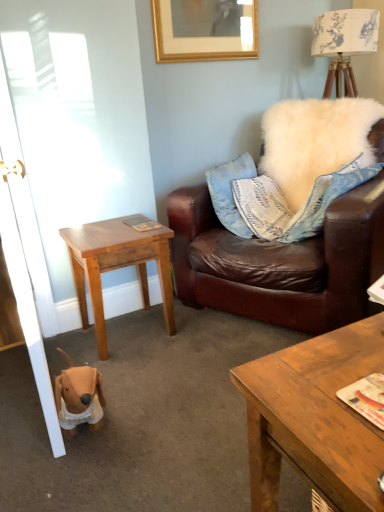
I want to click on vacant area on top of wooden coffee table at lower right (from a real-world perspective), so click(344, 367).